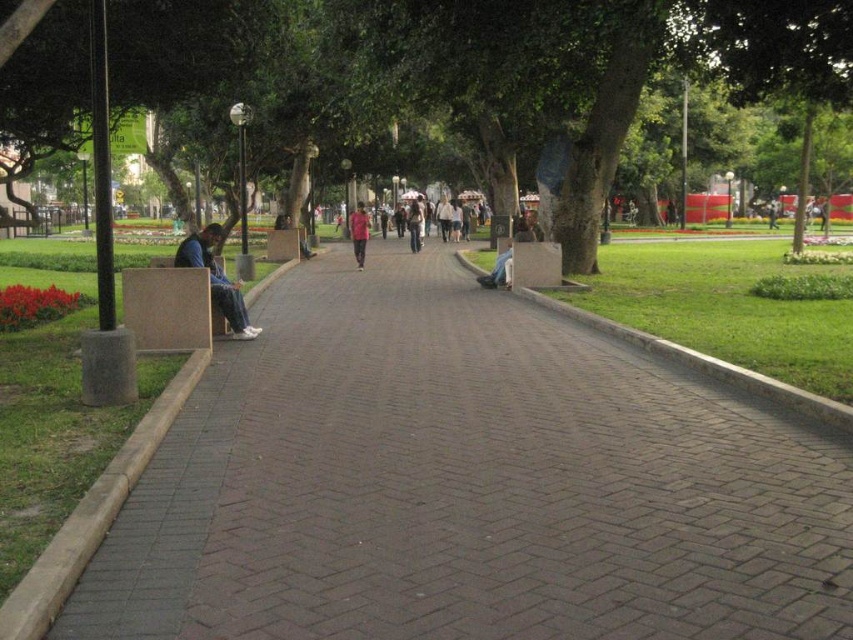
Question: From the image, what is the correct spatial relationship of brown brick pavement at center in relation to pink fabric shirt at center?

Choices:
 (A) above
 (B) below

Answer: (B)

Question: Which object is positioned closest to the green leafy tree at center?

Choices:
 (A) light brown leather jacket at center
 (B) dark blue jeans at left

Answer: (B)

Question: Estimate the real-world distances between objects in this image. Which object is closer to the light brown leather jacket at center?

Choices:
 (A) dark blue jeans at left
 (B) brown brick pavement at center
 (C) green leafy tree at center

Answer: (C)

Question: Does green leafy tree at center appear over dark blue jeans at left?

Choices:
 (A) no
 (B) yes

Answer: (B)

Question: Which object appears closest to the camera in this image?

Choices:
 (A) light brown leather jacket at center
 (B) pink fabric shirt at center

Answer: (B)

Question: Does green leafy tree at center lie behind dark blue jeans at left?

Choices:
 (A) no
 (B) yes

Answer: (A)